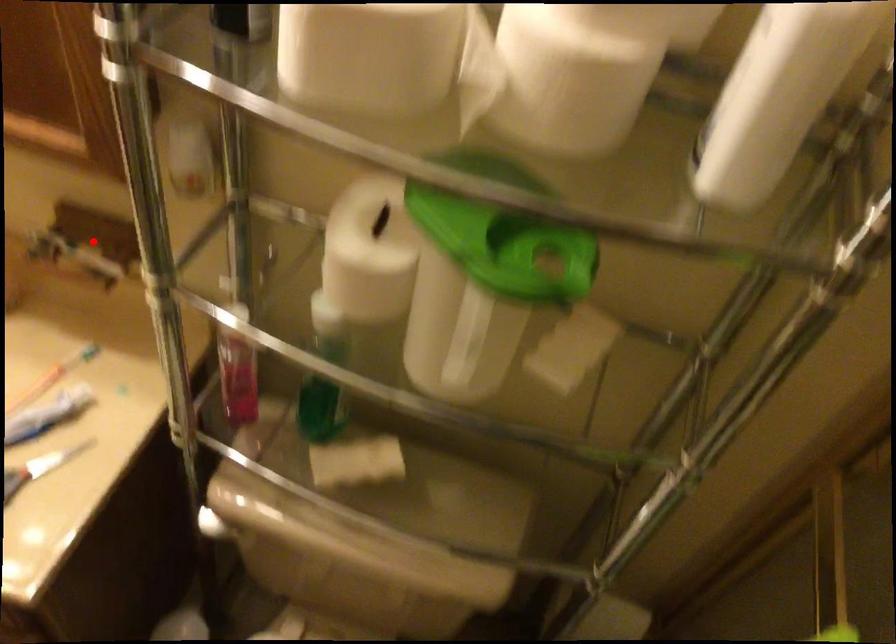
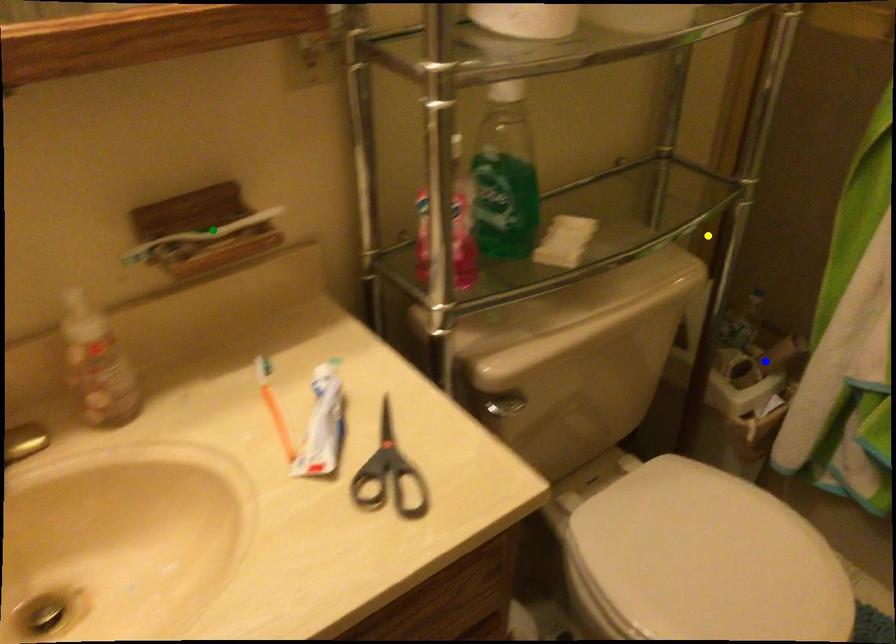
Question: I am providing you with two images of the same scene from different viewpoints. A red point is marked on the first image. You are given multiple points on the second image. Which spot in image 2 lines up with the point in image 1?

Choices:
 (A) green point
 (B) blue point
 (C) yellow point

Answer: (A)